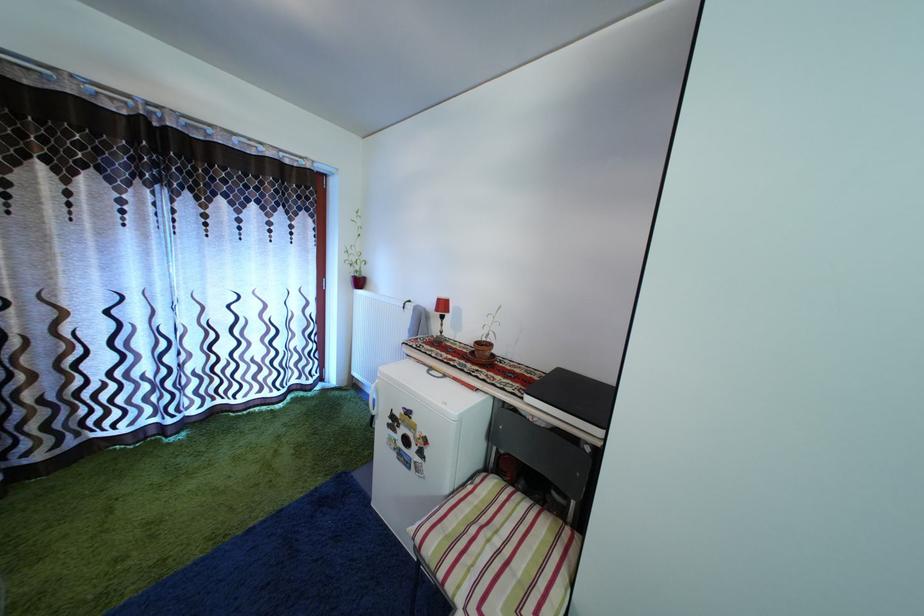
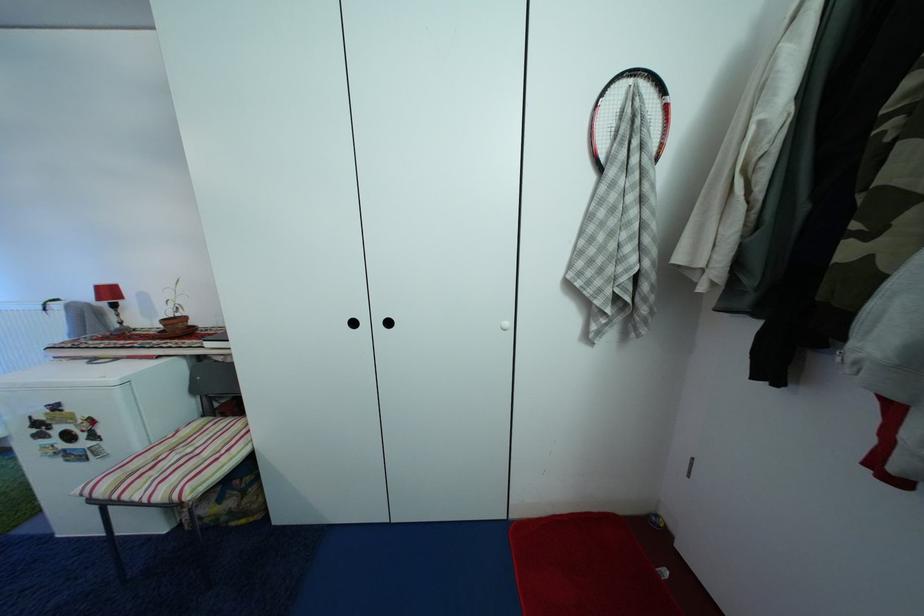
The point at (446, 308) is marked in the first image. Where is the corresponding point in the second image?

(106, 294)